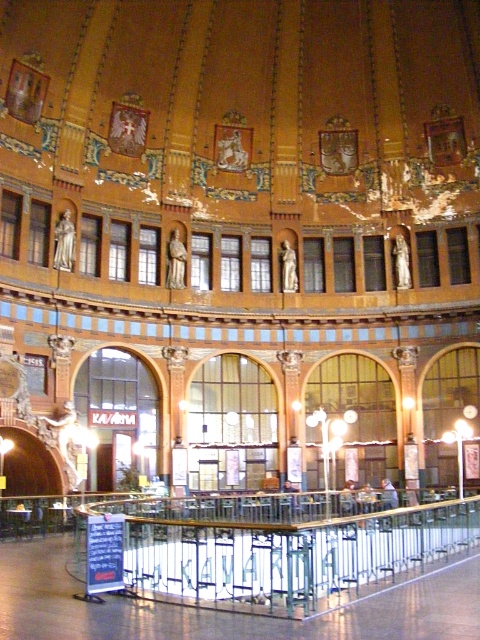
Question: Is silver metallic statue at center above matte gold statue at center?

Choices:
 (A) no
 (B) yes

Answer: (B)

Question: Where is golden statue at center located in relation to matte gold statue at center in the image?

Choices:
 (A) right
 (B) left

Answer: (B)

Question: Which object is the closest to the golden statue at center?

Choices:
 (A) polished bronze statue at upper left
 (B) matte gold statue at center
 (C) silver metallic statue at center
 (D) metallic glass balustrade at center

Answer: (B)

Question: Which of the following is the closest to the observer?

Choices:
 (A) silver metallic statue at center
 (B) golden statue at center

Answer: (B)

Question: Can you confirm if golden statue at center is thinner than silver metallic statue at center?

Choices:
 (A) yes
 (B) no

Answer: (A)

Question: Which point is closer to the camera taking this photo?

Choices:
 (A) (168, 570)
 (B) (398, 259)
 (C) (284, 269)
 (D) (168, 282)

Answer: (A)